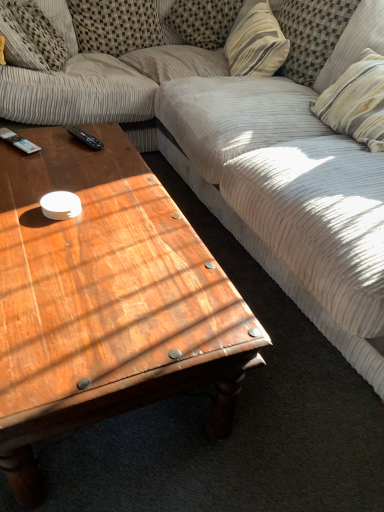
Question: Can you confirm if textured beige pillow at upper left, the 6th pillow from the right, is smaller than striped fabric pillow at upper right, which is the fifth pillow from left to right?

Choices:
 (A) yes
 (B) no

Answer: (A)

Question: Is striped fabric pillow at upper right, marked as the 2th pillow in a right-to-left arrangement, completely or partially inside textured beige pillow at upper left, the 6th pillow from the right?

Choices:
 (A) yes
 (B) no

Answer: (B)

Question: Is textured beige pillow at upper left, acting as the first pillow starting from the left, at the right side of striped fabric pillow at upper right, marked as the 2th pillow in a right-to-left arrangement?

Choices:
 (A) no
 (B) yes

Answer: (A)

Question: Does textured beige pillow at upper left, the 6th pillow from the right, lie behind striped fabric pillow at upper right, marked as the 2th pillow in a right-to-left arrangement?

Choices:
 (A) no
 (B) yes

Answer: (B)

Question: Can you confirm if textured beige pillow at upper left, the 6th pillow from the right, is shorter than striped fabric pillow at upper right, marked as the 2th pillow in a right-to-left arrangement?

Choices:
 (A) no
 (B) yes

Answer: (B)

Question: Considering the relative sizes of textured beige pillow at upper left, acting as the first pillow starting from the left, and striped fabric pillow at upper right, which is the fifth pillow from left to right, in the image provided, is textured beige pillow at upper left, acting as the first pillow starting from the left, bigger than striped fabric pillow at upper right, which is the fifth pillow from left to right,?

Choices:
 (A) no
 (B) yes

Answer: (A)

Question: From a real-world perspective, is striped fabric pillow at upper center, which is counted as the third pillow, starting from the left, located higher than checkered fabric pillow at upper left, acting as the 5th pillow starting from the right?

Choices:
 (A) yes
 (B) no

Answer: (A)

Question: From the image's perspective, would you say striped fabric pillow at upper center, which is counted as the third pillow, starting from the left, is shown under checkered fabric pillow at upper left, which is the second pillow in left-to-right order?

Choices:
 (A) yes
 (B) no

Answer: (B)

Question: From a real-world perspective, is striped fabric pillow at upper center, which appears as the 4th pillow when viewed from the right, below checkered fabric pillow at upper left, acting as the 5th pillow starting from the right?

Choices:
 (A) yes
 (B) no

Answer: (B)

Question: Does striped fabric pillow at upper center, which is counted as the third pillow, starting from the left, lie behind checkered fabric pillow at upper left, acting as the 5th pillow starting from the right?

Choices:
 (A) no
 (B) yes

Answer: (B)

Question: Is striped fabric pillow at upper center, which is counted as the third pillow, starting from the left, shorter than checkered fabric pillow at upper left, which is the second pillow in left-to-right order?

Choices:
 (A) no
 (B) yes

Answer: (B)

Question: Is striped fabric pillow at upper center, which appears as the 4th pillow when viewed from the right, next to checkered fabric pillow at upper left, acting as the 5th pillow starting from the right, and touching it?

Choices:
 (A) yes
 (B) no

Answer: (B)

Question: Is black plastic remote control at upper left, the second remote control in the right-to-left sequence, looking in the opposite direction of striped fabric pillow at upper center, which appears as the 4th pillow when viewed from the right?

Choices:
 (A) yes
 (B) no

Answer: (B)